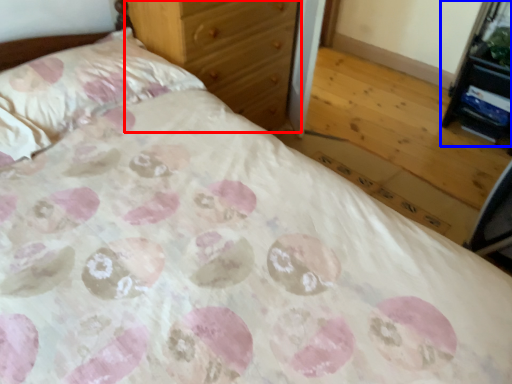
Question: Which object is further to the camera taking this photo, chest of drawers (highlighted by a red box) or vanity (highlighted by a blue box)?

Choices:
 (A) chest of drawers
 (B) vanity

Answer: (B)